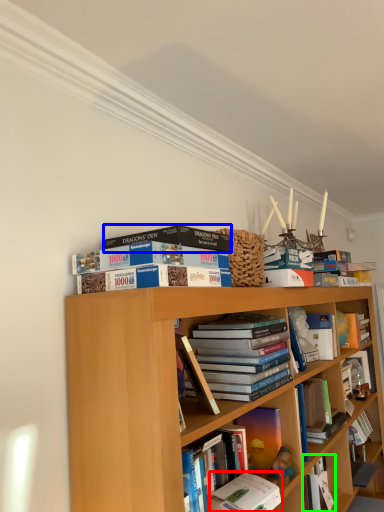
Question: Based on their relative distances, which object is nearer to book (highlighted by a red box)? Choose from book (highlighted by a blue box) and book (highlighted by a green box).

Choices:
 (A) book
 (B) book

Answer: (B)